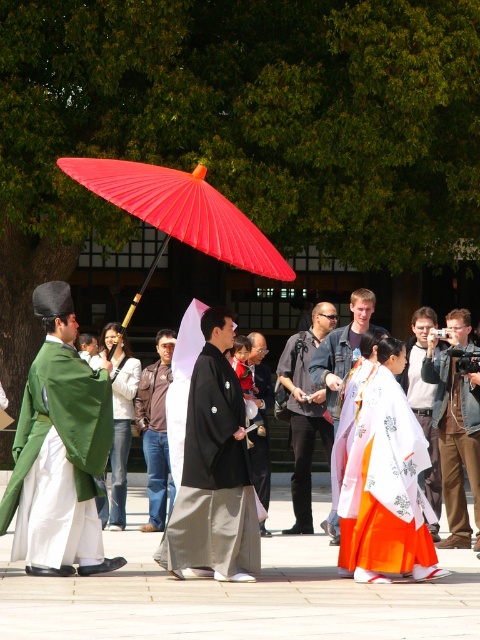
You are organizing a photo shoot and need to place two models wearing the white satin kimono at center and denim jacket at center. The photographer says they need to be at least 6 feet apart for the shot. Based on the scene, will their current positions meet the photographer requirements?

The distance between the white satin kimono at center and denim jacket at center is 6.01 feet, which is just over the required 6 feet. Therefore, their current positions meet the photographer requirements.

You are a photographer at the event and want to capture both the white satin kimono at center and the denim jacket at center in a single shot. Which clothing item will appear larger in the photo?

The white satin kimono at center will appear larger in the photo because it is closer to the viewer than the denim jacket at center.